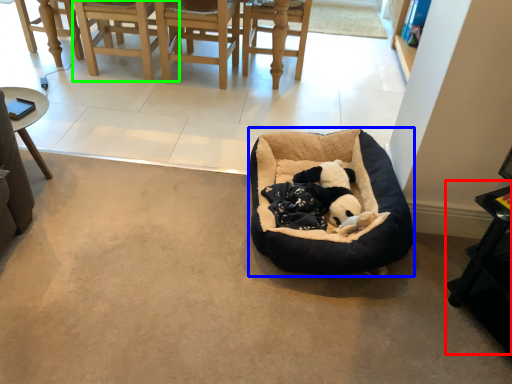
Question: Considering the real-world distances, which object is farthest from table (highlighted by a red box)? dog bed (highlighted by a blue box) or chair (highlighted by a green box)?

Choices:
 (A) dog bed
 (B) chair

Answer: (B)